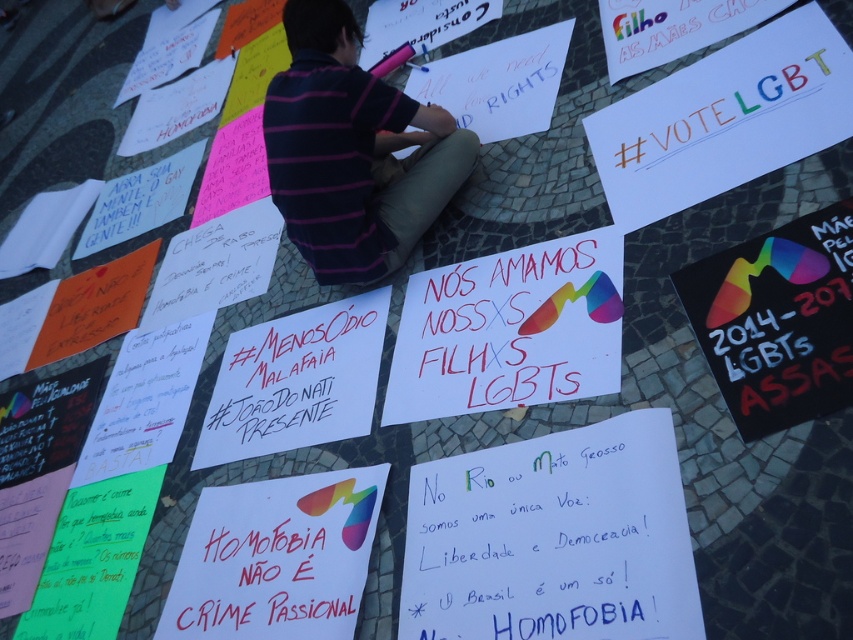
Question: Does striped cotton shirt at center lie behind matte white sign at center?

Choices:
 (A) no
 (B) yes

Answer: (B)

Question: Does striped cotton shirt at center have a lesser width compared to matte white sign at center?

Choices:
 (A) yes
 (B) no

Answer: (B)

Question: Which point is closer to the camera?

Choices:
 (A) striped cotton shirt at center
 (B) matte white sign at center

Answer: (B)

Question: Among these objects, which one is farthest from the camera?

Choices:
 (A) striped cotton shirt at center
 (B) matte white sign at center

Answer: (A)

Question: Is striped cotton shirt at center to the left of matte white sign at center from the viewer's perspective?

Choices:
 (A) no
 (B) yes

Answer: (A)